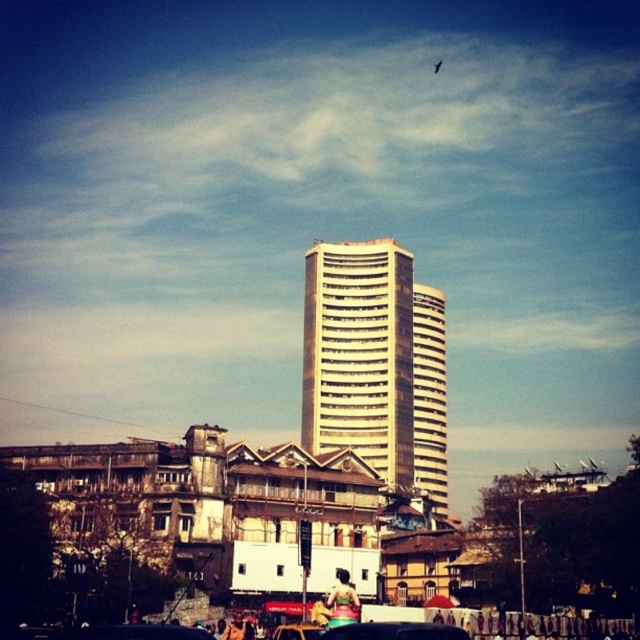
You are standing on the sidewalk in front of the skyscraper and see both the metallic silver car at center and the metallic gold car at center. Which car is positioned higher in the image?

The metallic silver car at center is positioned higher than the metallic gold car at center in the image.

You are standing at the entrance of the older, lowrise buildings in the foreground and want to take a photo of the white glossy building at center. Based on its position, which direction should you face to capture it in your view?

The white glossy building at center is located at point (376, 364), which means it is positioned centrally in the image. Since you are at the entrance of the older, lowrise buildings in the foreground, facing towards the center of the image would direct you toward the white glossy building at center.